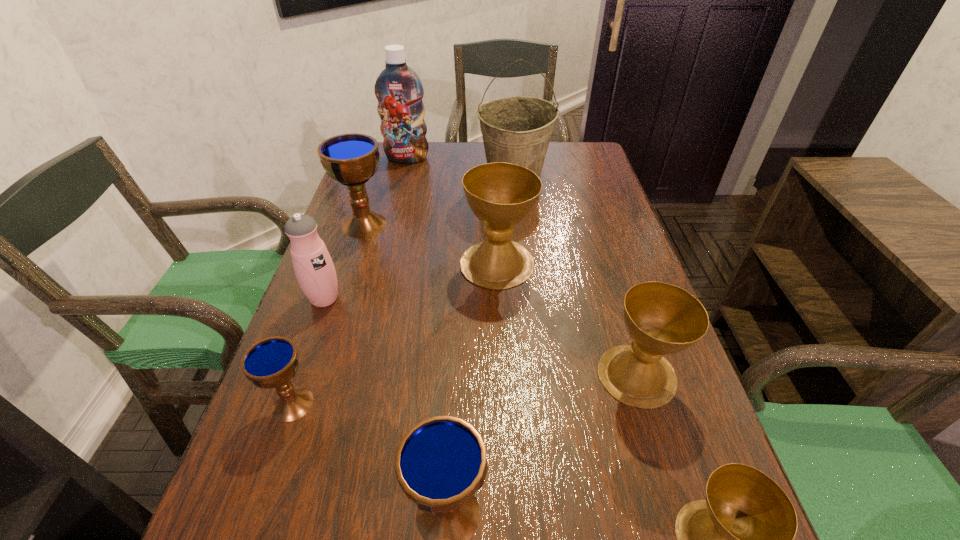
In order to click on wine bucket in this screenshot , I will do `click(517, 130)`.

Find the location of `blue shampoo`. blue shampoo is located at coordinates (398, 89).

This screenshot has width=960, height=540. I want to click on the biggest brown chalice, so click(501, 195).

I want to click on the farthest brown chalice, so click(x=501, y=195).

Image resolution: width=960 pixels, height=540 pixels. Identify the location of the farthest blue chalice. (352, 159).

At what (x,y) coordinates should I click in order to perform the action: click on thermos bottle. Please return your answer as a coordinate pair (x, y). This screenshot has width=960, height=540. Looking at the image, I should click on (314, 269).

Image resolution: width=960 pixels, height=540 pixels. Find the location of `the second biggest brown chalice`. the second biggest brown chalice is located at coordinates (662, 319).

Locate an element on the screen. Image resolution: width=960 pixels, height=540 pixels. the second farthest blue chalice is located at coordinates (270, 363).

Image resolution: width=960 pixels, height=540 pixels. I want to click on free space located 0.170m on the front of the wine bucket, so click(x=520, y=232).

This screenshot has height=540, width=960. I want to click on free spot located 0.370m on the front label of the blue shampoo, so click(x=388, y=235).